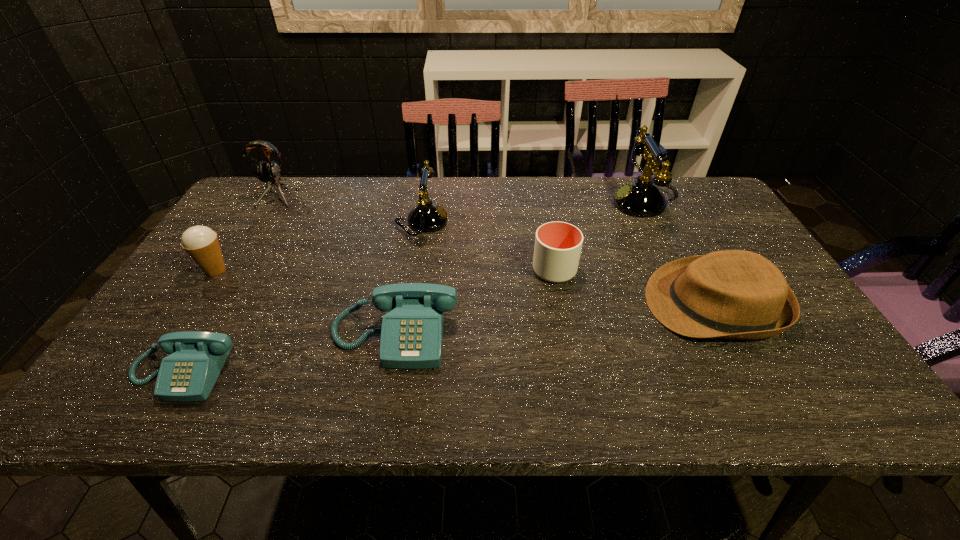
Locate an element on the screen. The image size is (960, 540). empty space that is in between the earphone and the brown fedora is located at coordinates coord(493,250).

At what (x,y) coordinates should I click in order to perform the action: click on vacant area that lies between the brown fedora and the icecream. Please return your answer as a coordinate pair (x, y). The width and height of the screenshot is (960, 540). Looking at the image, I should click on (465, 287).

Locate an element on the screen. The height and width of the screenshot is (540, 960). free space between the second tallest telephone and the white cup is located at coordinates (489, 246).

Identify the location of vacant space that's between the brown fedora and the second shortest telephone. The image size is (960, 540). (554, 320).

Where is `empty location between the sixth object from left to right and the earphone`? empty location between the sixth object from left to right and the earphone is located at coordinates (414, 233).

I want to click on free space between the brown fedora and the bigger black telephone, so click(x=679, y=253).

Locate an element on the screen. vacant space that is in between the second shortest telephone and the fedora is located at coordinates (554, 320).

The width and height of the screenshot is (960, 540). I want to click on object that is the sixth nearest to the icecream, so click(x=731, y=294).

The image size is (960, 540). I want to click on the third closest object to the bigger blue telephone, so click(427, 217).

Identify the location of the closest telephone to the third tallest telephone. (189, 373).